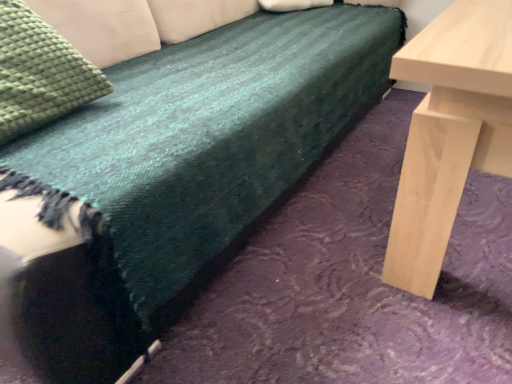
Where is `green knitted pillow at upper left`? The height and width of the screenshot is (384, 512). green knitted pillow at upper left is located at coordinates (40, 73).

What do you see at coordinates (40, 73) in the screenshot? The image size is (512, 384). I see `green knitted pillow at upper left` at bounding box center [40, 73].

This screenshot has width=512, height=384. What are the coordinates of `green knitted pillow at upper left` in the screenshot? It's located at (40, 73).